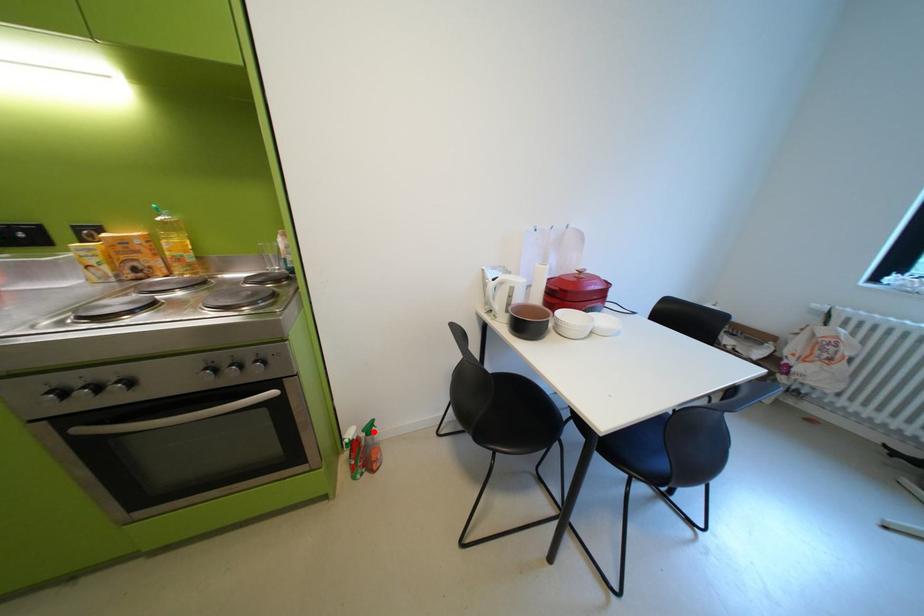
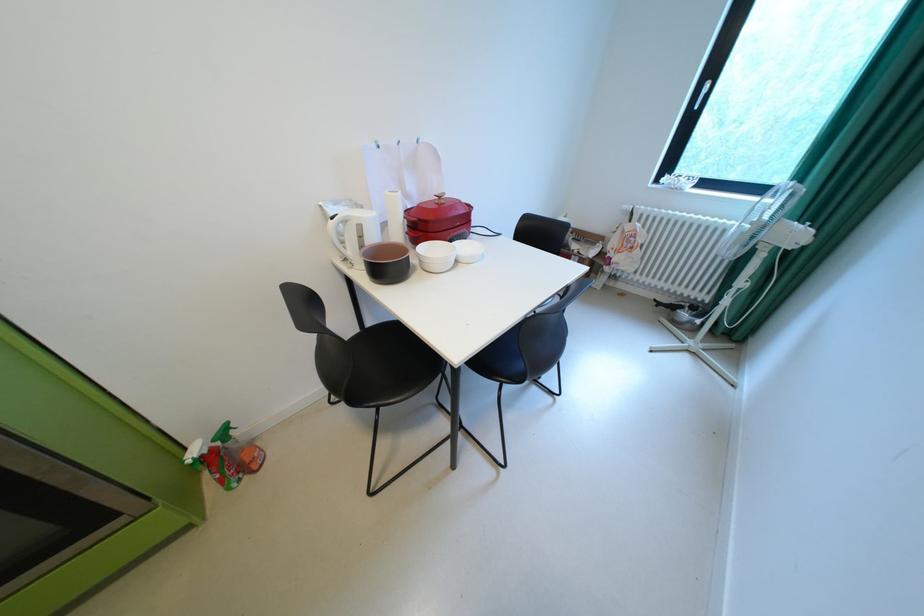
The point at the highlighted location is marked in the first image. Where is the corresponding point in the second image?

(224, 442)